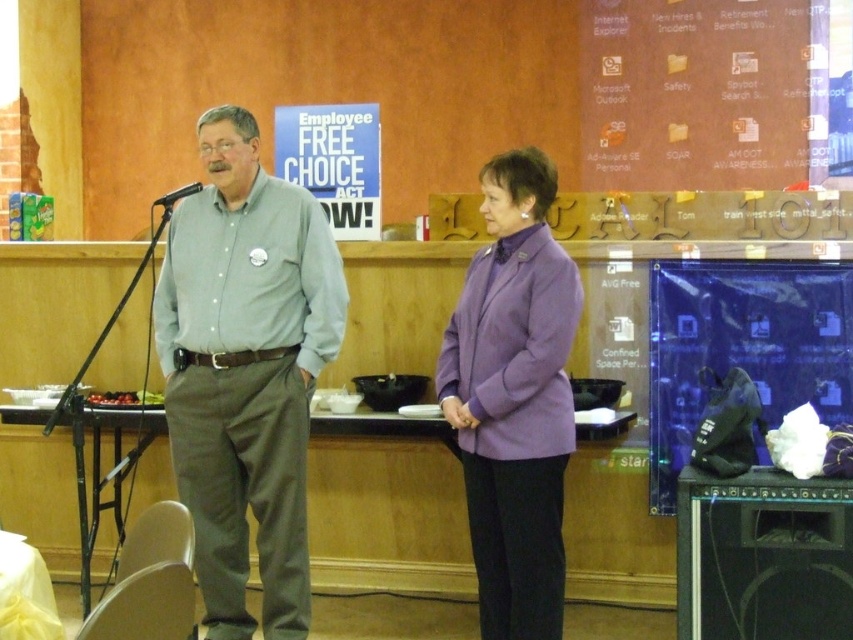
You are an event photographer at a formal presentation. You need to capture a photo where the purple fabric jacket at center is positioned to the right of the shiny red grapes at lower left. Is this possible given the current arrangement?

Yes, because the purple fabric jacket at center is already positioned to the right of the shiny red grapes at lower left.